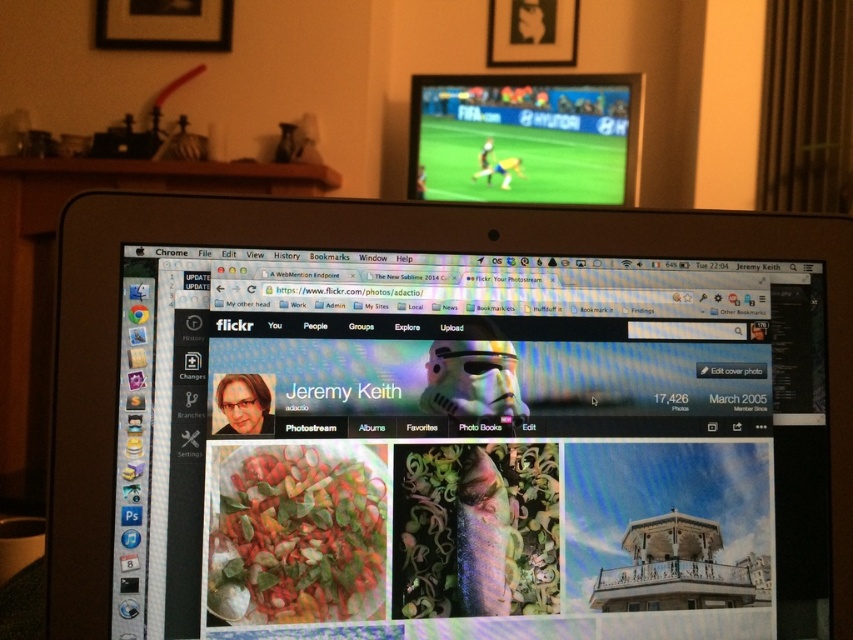
You are a photographer who wants to take a photo of the satin black monitor at center from your current position. Considering the distance between you and the monitor, can you capture the entire screen in one shot without moving closer or farther away?

The satin black monitor at center is 18.04 inches away from the camera. To capture the entire screen in one shot without moving, you need to ensure your camera has a wide enough angle or use a lens that can accommodate the monitor size at this distance. However, without knowing the monitor size or camera specifications, it is impossible to definitively answer.

You are setting up a home office and want to place both the satin black monitor at center and the matte plastic tv at upper center on a desk. Given that the desk has limited space, which object should you prioritize placing first based on their widths?

The satin black monitor at center has a greater width than the matte plastic tv at upper center, so you should prioritize placing the satin black monitor at center first to ensure it fits properly on the desk.

You are setting up a home office and have both the satin black monitor at center and the matte plastic tv at upper center. Which device is located to the left of the other?

The satin black monitor at center is positioned on the left side of matte plastic tv at upper center.